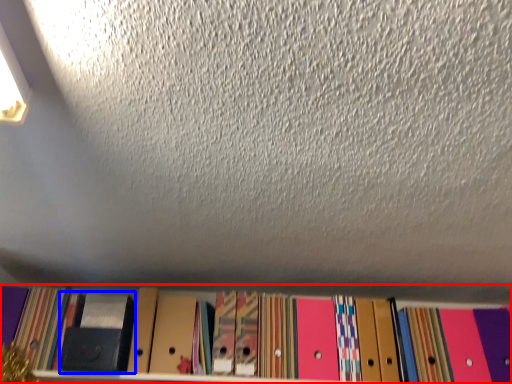
Question: Which point is further to the camera, shelf (highlighted by a red box) or paperback book (highlighted by a blue box)?

Choices:
 (A) shelf
 (B) paperback book

Answer: (B)